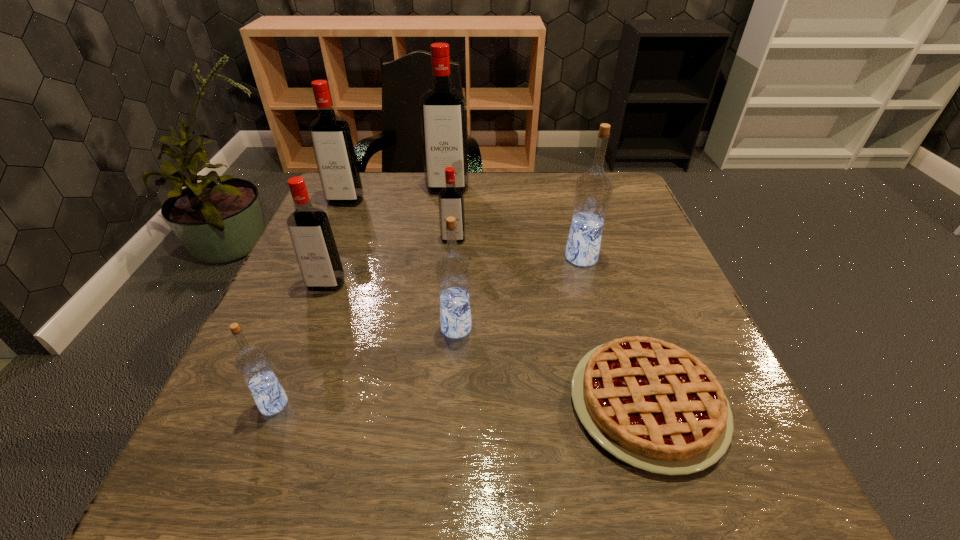
Image resolution: width=960 pixels, height=540 pixels. In order to click on vacant space at the left edge in this screenshot , I will do `click(262, 420)`.

Identify the location of free spot at the right edge of the desktop. (617, 232).

Locate an element on the screen. Image resolution: width=960 pixels, height=540 pixels. vacant point at the far left corner is located at coordinates pos(379,176).

At what (x,y) coordinates should I click in order to perform the action: click on free space at the far right corner. Please return your answer as a coordinate pair (x, y). This screenshot has height=540, width=960. Looking at the image, I should click on (617, 173).

This screenshot has width=960, height=540. I want to click on unoccupied position between the shortest object and the rightmost blue vodka, so click(x=614, y=330).

The width and height of the screenshot is (960, 540). I want to click on vacant point located between the rightmost blue vodka and the third farthest red vodka, so click(x=517, y=248).

Identify the location of blank region between the fourth farthest object and the biggest red vodka. Image resolution: width=960 pixels, height=540 pixels. (515, 223).

What are the coordinates of `vacant space that is in between the leftmost blue vodka and the second biggest red vodka` in the screenshot? It's located at (310, 302).

Identify the location of free space between the shortest object and the second biggest red vodka. The width and height of the screenshot is (960, 540). (496, 302).

At what (x,y) coordinates should I click in order to perform the action: click on vacant area that lies between the second biggest red vodka and the second biggest blue vodka. Please return your answer as a coordinate pair (x, y). Looking at the image, I should click on (401, 264).